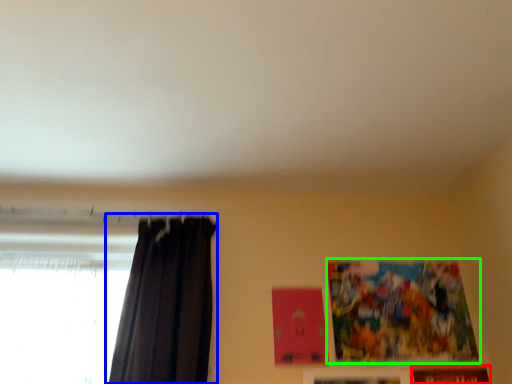
Question: Based on their relative distances, which object is farther from picture frame (highlighted by a red box)? Choose from curtain (highlighted by a blue box) and picture frame (highlighted by a green box).

Choices:
 (A) curtain
 (B) picture frame

Answer: (A)